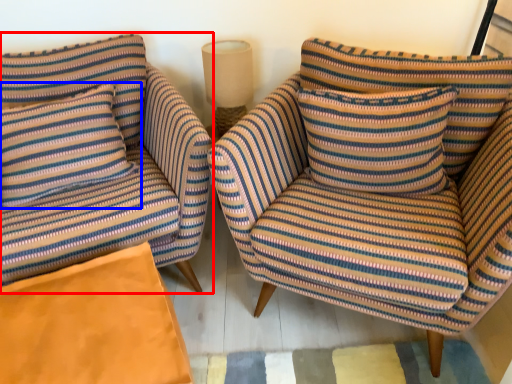
Question: Which object appears farthest to the camera in this image, chair (highlighted by a red box) or pillow (highlighted by a blue box)?

Choices:
 (A) chair
 (B) pillow

Answer: (B)